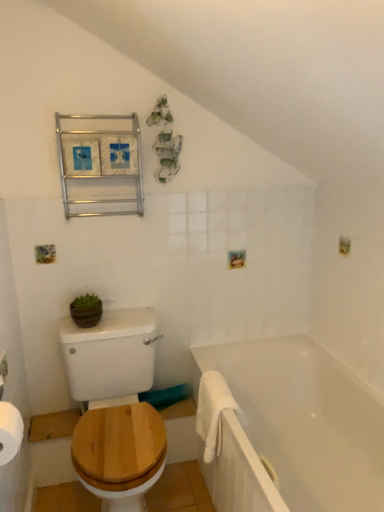
I want to click on white glossy bathtub at lower right, so click(x=306, y=420).

This screenshot has width=384, height=512. What do you see at coordinates (10, 432) in the screenshot?
I see `white paper at lower left` at bounding box center [10, 432].

This screenshot has height=512, width=384. Describe the element at coordinates (86, 310) in the screenshot. I see `green matte pot at center` at that location.

Describe the element at coordinates (213, 411) in the screenshot. I see `white fluffy bath towel at lower right` at that location.

What is the approximate height of wooden at left?

It is 79.06 centimeters.

Where is `metallic frame at upper left`? Image resolution: width=384 pixels, height=512 pixels. metallic frame at upper left is located at coordinates (100, 164).

Does point (21, 439) come in front of point (264, 345)?

Yes, point (21, 439) is closer to viewer.

Looking at this image, which object is more forward, white paper at lower left or white glossy bathtub at lower right?

white paper at lower left is in front.

Considering the sizes of white paper at lower left and white glossy bathtub at lower right in the image, is white paper at lower left bigger or smaller than white glossy bathtub at lower right?

Considering their sizes, white paper at lower left takes up less space than white glossy bathtub at lower right.

From the picture: Is there a large distance between white paper at lower left and white glossy bathtub at lower right?

white paper at lower left is positioned a significant distance from white glossy bathtub at lower right.

From a real-world perspective, which object rests below the other?

white fluffy bath towel at lower right.

In the scene shown: Are white fluffy bath towel at lower right and metallic frame at upper left located far from each other?

That's right, there is a large distance between white fluffy bath towel at lower right and metallic frame at upper left.

Based on their sizes in the image, would you say white fluffy bath towel at lower right is bigger or smaller than metallic frame at upper left?

white fluffy bath towel at lower right is smaller than metallic frame at upper left.

Measure the distance between white fluffy bath towel at lower right and metallic frame at upper left.

A distance of 1.03 meters exists between white fluffy bath towel at lower right and metallic frame at upper left.

From a real-world perspective, which is physically below, white glossy bathtub at lower right or white paper at lower left?

white glossy bathtub at lower right is physically lower.

From the image's perspective, who appears lower, white glossy bathtub at lower right or white paper at lower left?

white glossy bathtub at lower right appears lower in the image.

Is there a large distance between white paper at lower left and white fluffy bath towel at lower right?

No, white paper at lower left is not far away from white fluffy bath towel at lower right.

How far apart are white paper at lower left and white fluffy bath towel at lower right?

A distance of 88.01 centimeters exists between white paper at lower left and white fluffy bath towel at lower right.

Can you confirm if white paper at lower left is thinner than white fluffy bath towel at lower right?

Indeed, white paper at lower left has a lesser width compared to white fluffy bath towel at lower right.

Is point (20, 432) farther from camera compared to point (199, 409)?

No, (20, 432) is in front of (199, 409).

Looking at this image, considering the relative sizes of white paper at lower left and green matte pot at center in the image provided, is white paper at lower left shorter than green matte pot at center?

Yes.

Between white paper at lower left and green matte pot at center, which one has smaller width?

green matte pot at center is thinner.

Can you confirm if white paper at lower left is bigger than green matte pot at center?

Yes.

Based on the photo, is the surface of white paper at lower left in direct contact with green matte pot at center?

No, white paper at lower left is not with green matte pot at center.

From a real-world perspective, does metallic frame at upper left sit lower than white glossy bathtub at lower right?

Actually, metallic frame at upper left is physically above white glossy bathtub at lower right in the real world.

How distant is metallic frame at upper left from white glossy bathtub at lower right?

They are 1.15 meters apart.

Identify the location of bathtub on the right of metallic frame at upper left. This screenshot has width=384, height=512. (306, 420).

Considering the sizes of objects metallic frame at upper left and white glossy bathtub at lower right in the image provided, who is thinner, metallic frame at upper left or white glossy bathtub at lower right?

metallic frame at upper left is thinner.

Does green matte pot at center appear on the left side of wooden at left?

Yes, green matte pot at center is to the left of wooden at left.

Can you confirm if green matte pot at center is wider than wooden at left?

No, green matte pot at center is not wider than wooden at left.

In the image, there is a white paper at lower left. Identify the location of bathtub below it (from the image's perspective). This screenshot has width=384, height=512. (306, 420).

Locate an element on the screen. This screenshot has width=384, height=512. bath towel that appears below the metallic frame at upper left (from a real-world perspective) is located at coordinates (213, 411).

From the image, which object appears to be farther from white paper at lower left, green matte pot at center or white glossy bathtub at lower right?

white glossy bathtub at lower right.

Based on the photo, looking at the image, which one is located closer to white paper at lower left, green matte pot at center or metallic frame at upper left?

green matte pot at center is closer to white paper at lower left.

Which object lies further to the anchor point green matte pot at center, white glossy bathtub at lower right or white fluffy bath towel at lower right?

white glossy bathtub at lower right.

In the scene shown: Which object lies further to the anchor point wooden at left, white glossy bathtub at lower right or green matte pot at center?

white glossy bathtub at lower right is further to wooden at left.

From the image, which object appears to be nearer to green matte pot at center, metallic frame at upper left or white paper at lower left?

metallic frame at upper left is positioned closer to the anchor green matte pot at center.

When comparing their distances from white glossy bathtub at lower right, does white paper at lower left or wooden at left seem further?

white paper at lower left.

From the picture: Looking at the image, which one is located closer to white fluffy bath towel at lower right, wooden at left or white paper at lower left?

wooden at left is positioned closer to the anchor white fluffy bath towel at lower right.

Considering their positions, is green matte pot at center positioned closer to white glossy bathtub at lower right than metallic frame at upper left?

The object closer to white glossy bathtub at lower right is green matte pot at center.

This screenshot has width=384, height=512. I want to click on sit between green matte pot at center and white glossy bathtub at lower right in the horizontal direction, so click(115, 407).

Where is `bath towel between metallic frame at upper left and wooden at left vertically`? The width and height of the screenshot is (384, 512). bath towel between metallic frame at upper left and wooden at left vertically is located at coordinates (213, 411).

The width and height of the screenshot is (384, 512). Find the location of `bath towel between wooden at left and white glossy bathtub at lower right in the horizontal direction`. bath towel between wooden at left and white glossy bathtub at lower right in the horizontal direction is located at coordinates (213, 411).

You are a GUI agent. You are given a task and a screenshot of the screen. Output one action in this format:
    pyautogui.click(x=<x>, y=<y>)
    Task: Click on the plant between metallic frame at upper left and wooden at left vertically
    
    Given the screenshot: What is the action you would take?
    pyautogui.click(x=86, y=310)